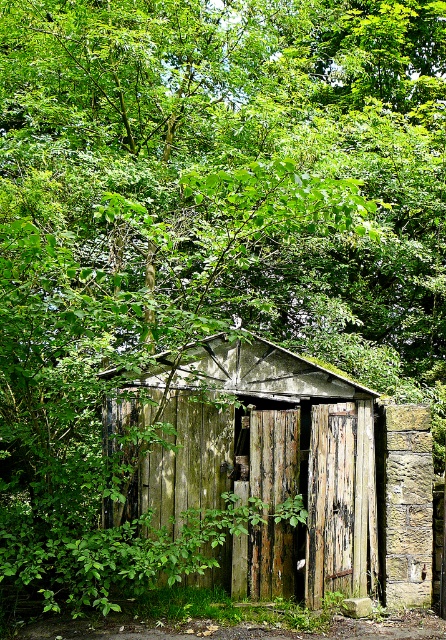
Question: Which point is farther to the camera?

Choices:
 (A) coord(335,552)
 (B) coord(255,580)

Answer: (A)

Question: Which of the following is the farthest from the observer?

Choices:
 (A) (351, 544)
 (B) (288, 577)
 (C) (276, 435)

Answer: (A)

Question: Is weathered wood hut at center bigger than weathered wood door at center?

Choices:
 (A) no
 (B) yes

Answer: (B)

Question: Which point is farther to the camera?

Choices:
 (A) (425, 598)
 (B) (321, 604)
 (C) (280, 456)

Answer: (A)

Question: Can you confirm if peeling wood door at center is bigger than weathered wood door at center?

Choices:
 (A) no
 (B) yes

Answer: (B)

Question: Does peeling wood door at center come in front of weathered wood door at center?

Choices:
 (A) yes
 (B) no

Answer: (A)